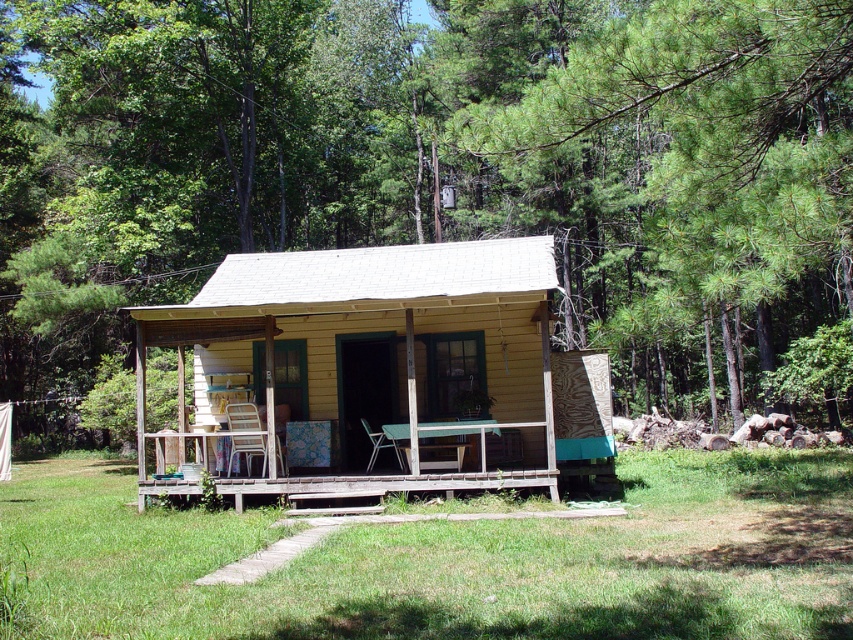
Does yellow wood log cabin at center have a greater height compared to metallic mesh chair at center?

Indeed, yellow wood log cabin at center has a greater height compared to metallic mesh chair at center.

Can you confirm if yellow wood log cabin at center is thinner than metallic mesh chair at center?

No, yellow wood log cabin at center is not thinner than metallic mesh chair at center.

You are a GUI agent. You are given a task and a screenshot of the screen. Output one action in this format:
    pyautogui.click(x=<x>, y=<y>)
    Task: Click on the yellow wood log cabin at center
    The image size is (853, 640).
    Given the screenshot: What is the action you would take?
    pyautogui.click(x=379, y=353)

Locate an element on the screen. yellow wood log cabin at center is located at coordinates 379,353.

Does yellow wood log cabin at center have a larger size compared to wooden porch at center?

Correct, yellow wood log cabin at center is larger in size than wooden porch at center.

This screenshot has height=640, width=853. I want to click on yellow wood log cabin at center, so click(x=379, y=353).

Does wooden porch at center have a greater width compared to metallic mesh chair at center?

No.

Which is above, wooden porch at center or metallic mesh chair at center?

Positioned higher is metallic mesh chair at center.

You are a GUI agent. You are given a task and a screenshot of the screen. Output one action in this format:
    pyautogui.click(x=<x>, y=<y>)
    Task: Click on the wooden porch at center
    This screenshot has height=640, width=853.
    Given the screenshot: What is the action you would take?
    pyautogui.click(x=389, y=483)

You are a GUI agent. You are given a task and a screenshot of the screen. Output one action in this format:
    pyautogui.click(x=<x>, y=<y>)
    Task: Click on the wooden porch at center
    The height and width of the screenshot is (640, 853).
    Given the screenshot: What is the action you would take?
    (x=389, y=483)